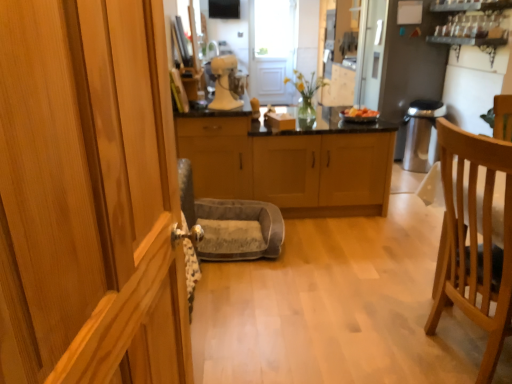
You are a GUI agent. You are given a task and a screenshot of the screen. Output one action in this format:
    pyautogui.click(x=<x>, y=<y>)
    Task: Click on the empty space that is in between light brown wooden chair at right and velvet gray pet bed at center
    The width and height of the screenshot is (512, 384).
    Given the screenshot: What is the action you would take?
    pyautogui.click(x=325, y=289)